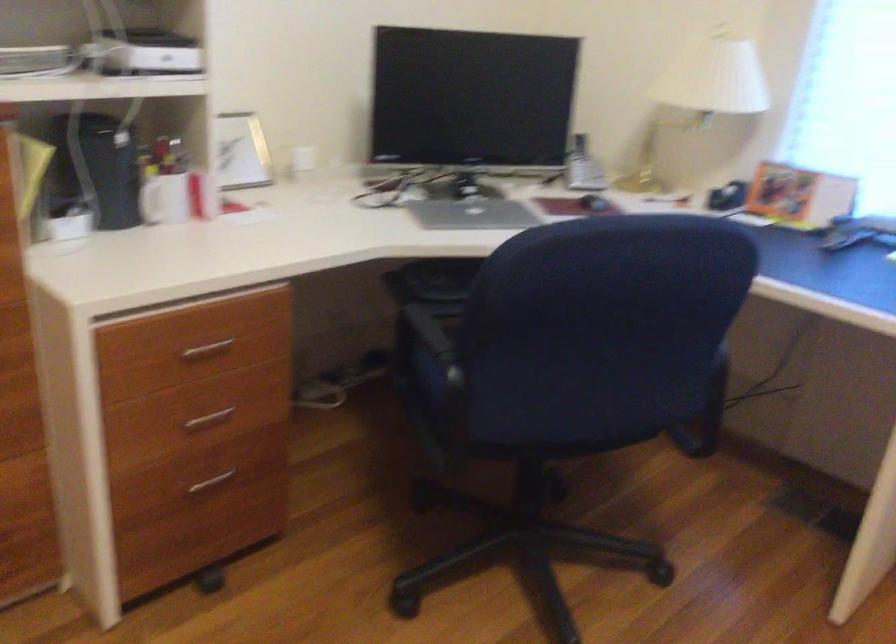
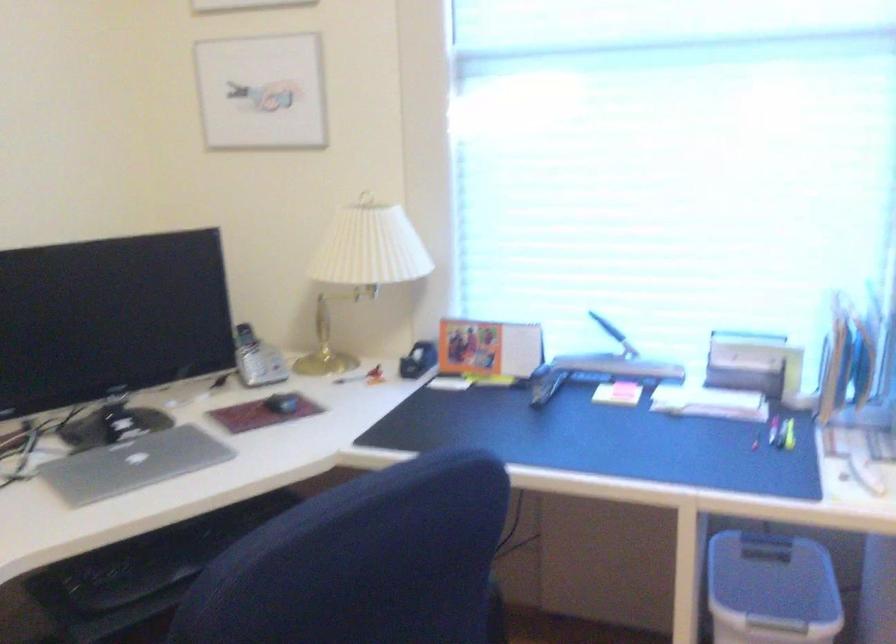
Question: The camera is either moving clockwise (left) or counter-clockwise (right) around the object. The first image is from the beginning of the video and the second image is from the end. Is the camera moving left or right when shooting the video?

Choices:
 (A) Left
 (B) Right

Answer: (A)